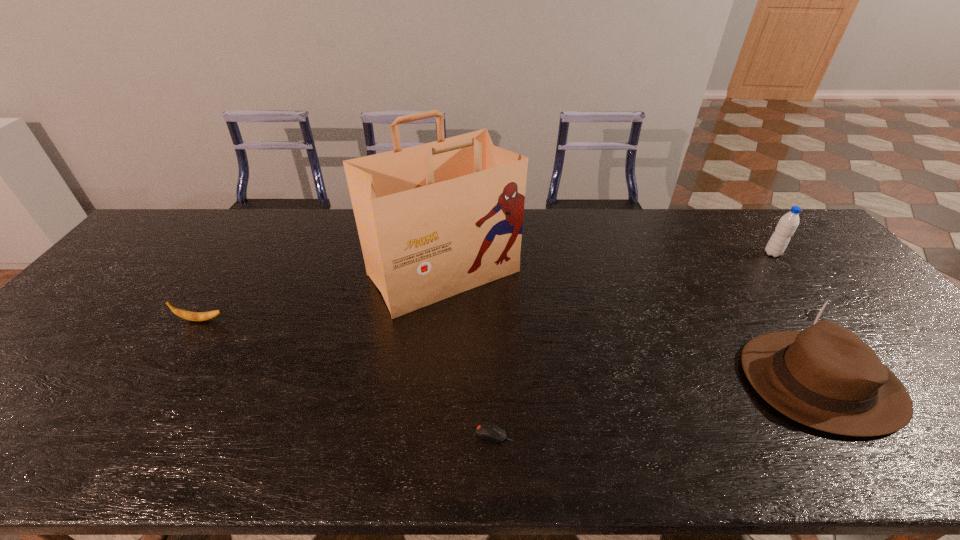
Find the location of a particular element. object present at the near right corner is located at coordinates (825, 377).

What are the coordinates of `free spot at the far edge of the desktop` in the screenshot? It's located at (752, 233).

In the image, there is a desktop. Find the location of `vacant space at the near edge`. vacant space at the near edge is located at coordinates (433, 431).

This screenshot has width=960, height=540. I want to click on vacant region at the left edge of the desktop, so click(x=162, y=273).

At what (x,y) coordinates should I click in order to perform the action: click on free space at the right edge of the desktop. Please return your answer as a coordinate pair (x, y). This screenshot has width=960, height=540. Looking at the image, I should click on (911, 366).

You are a GUI agent. You are given a task and a screenshot of the screen. Output one action in this format:
    pyautogui.click(x=<x>, y=<y>)
    Task: Click on the blank space at the far left corner of the desktop
    The image size is (960, 540).
    Given the screenshot: What is the action you would take?
    pyautogui.click(x=198, y=228)

Where is `empty space that is in between the water bottle and the fedora`? empty space that is in between the water bottle and the fedora is located at coordinates (797, 318).

The width and height of the screenshot is (960, 540). I want to click on free spot between the fedora and the leftmost object, so click(511, 351).

At what (x,y) coordinates should I click in order to perform the action: click on free point between the water bottle and the computer mouse. Please return your answer as a coordinate pair (x, y). This screenshot has width=960, height=540. Looking at the image, I should click on (634, 343).

Identify the location of empty space that is in between the leftmost object and the tallest object. This screenshot has height=540, width=960. (323, 297).